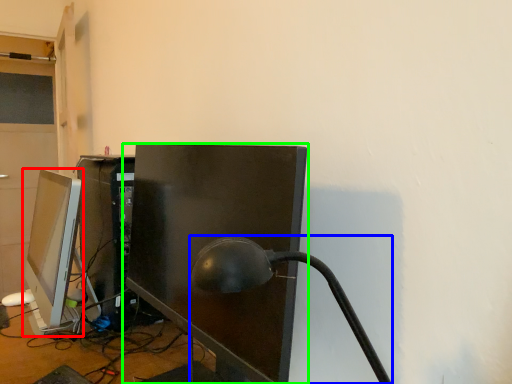
Question: Estimate the real-world distances between objects in this image. Which object is farther from computer monitor (highlighted by a red box), table lamp (highlighted by a blue box) or computer monitor (highlighted by a green box)?

Choices:
 (A) table lamp
 (B) computer monitor

Answer: (A)